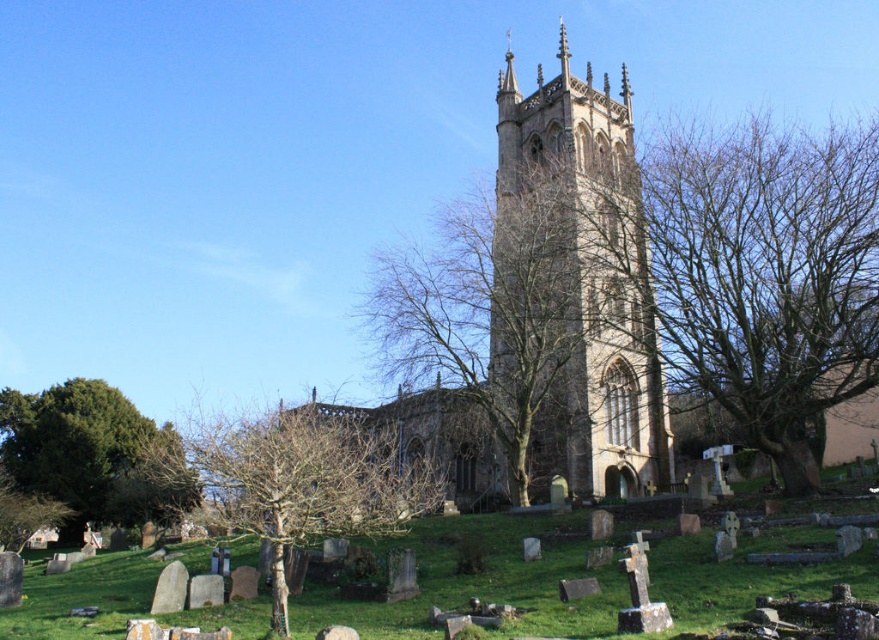
You are standing in the churchyard and want to walk from the green leafy tree at lower left to the green grassy at center. Which direction should you head?

You should head to the right because the green grassy at center is located to the right of the green leafy tree at lower left.

In the scene shown: You are standing in the churchyard and want to take a photo of the brown stone church at center and the green leafy tree at lower left. Which object should you focus on first if you want to capture both in a single frame without moving the camera?

The brown stone church at center is taller than the green leafy tree at lower left, so you should focus on the brown stone church at center first to ensure it fits within the frame.

You are standing in the churchyard and want to place a small garden ornament. The ornament requires a space larger than the area occupied by the bare branches at lower left. Can the green grassy at center accommodate it?

The green grassy at center is bigger than the bare branches at lower left, so yes, the green grassy at center can accommodate the ornament as it has a larger area available.